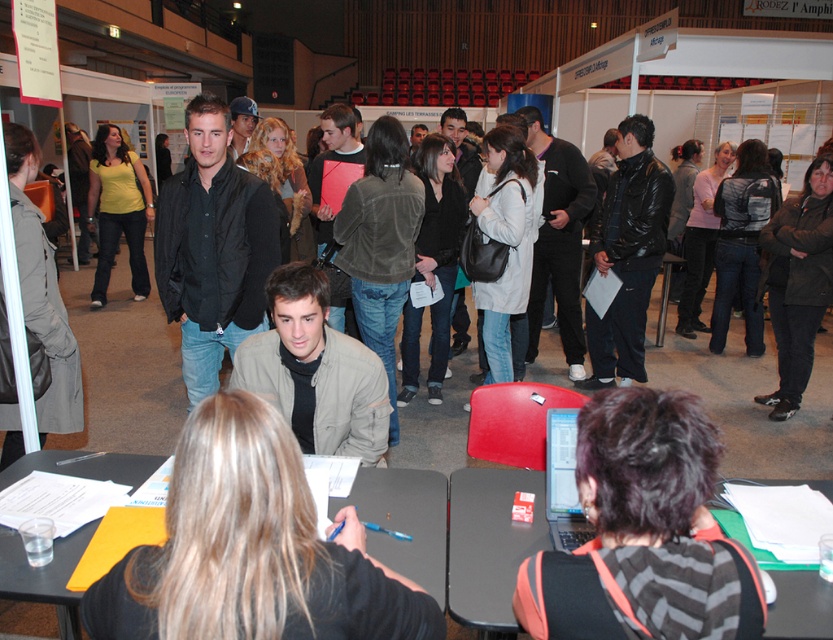
You are standing at the center of the hall and want to reach the black plastic table at lower right. According to the coordinates provided, in which direction should you move from your current position to reach it?

The black plastic table at lower right is located at coordinates point (489, 545), so you should move towards the lower right direction from your current position at the center of the hall to reach it.

You are attending a job fair and need to move from the black plastic table at lower right to the black plastic table at center. Which direction should you move to reach the destination?

To move from the black plastic table at lower right to the black plastic table at center, you should move to the left since the black plastic table at lower right is positioned to the right of the black plastic table at center.

Consider the image. You are organizing a small meeting and need to choose between the black plastic table at lower right and the black plastic table at center for seating two people. Based on their sizes, which table would be more appropriate?

The black plastic table at center is more appropriate because it has a larger size compared to the black plastic table at lower right, providing more space for two people.